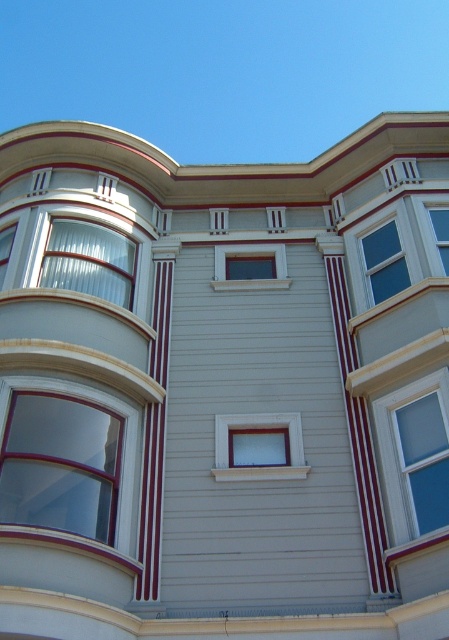
Question: Can you confirm if white glass window at center is bigger than clear glass window at left?

Choices:
 (A) no
 (B) yes

Answer: (B)

Question: Which object is positioned closest to the white glass window at center?

Choices:
 (A) clear glass window at upper right
 (B) translucent glass window at upper left
 (C) matte glass window at center

Answer: (A)

Question: Can you confirm if translucent glass window at upper left is wider than clear glass window at left?

Choices:
 (A) yes
 (B) no

Answer: (A)

Question: Can you confirm if matte glass window at right is positioned below clear glass window at left?

Choices:
 (A) no
 (B) yes

Answer: (B)

Question: Which object is closer to the camera taking this photo?

Choices:
 (A) matte glass window at left
 (B) matte glass window at center
 (C) white glass window at center
 (D) matte white window at center

Answer: (A)

Question: Which of the following is the farthest from the observer?

Choices:
 (A) (255, 456)
 (B) (100, 275)
 (C) (443, 237)

Answer: (C)